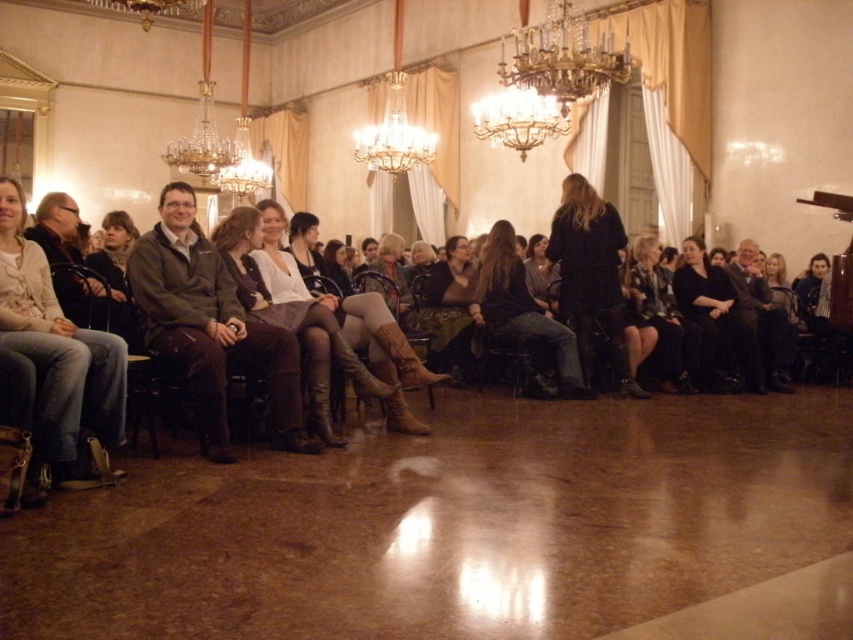
Looking at this image, can you confirm if dark brown leather jacket at center is shorter than denim jeans at center?

In fact, dark brown leather jacket at center may be taller than denim jeans at center.

Is dark brown leather jacket at center in front of denim jeans at center?

Yes, dark brown leather jacket at center is closer to the viewer.

At what (x,y) coordinates should I click in order to perform the action: click on dark brown leather jacket at center. Please return your answer as a coordinate pair (x, y). The height and width of the screenshot is (640, 853). Looking at the image, I should click on pyautogui.click(x=210, y=326).

Locate an element on the screen. The image size is (853, 640). dark brown leather jacket at center is located at coordinates (210, 326).

Is black velvet dress at right to the left of dark gray sweater at right from the viewer's perspective?

Correct, you'll find black velvet dress at right to the left of dark gray sweater at right.

Between black velvet dress at right and dark gray sweater at right, which one appears on the left side from the viewer's perspective?

Positioned to the left is black velvet dress at right.

At what (x,y) coordinates should I click in order to perform the action: click on black velvet dress at right. Please return your answer as a coordinate pair (x, y). The image size is (853, 640). Looking at the image, I should click on (717, 314).

Based on the photo, who is higher up, black leather jacket at center or gold metallic chandelier at upper center?

gold metallic chandelier at upper center is higher up.

Between point (572, 259) and point (582, 97), which one is positioned behind?

The point (582, 97) is behind.

Locate an element on the screen. This screenshot has width=853, height=640. black leather jacket at center is located at coordinates (590, 275).